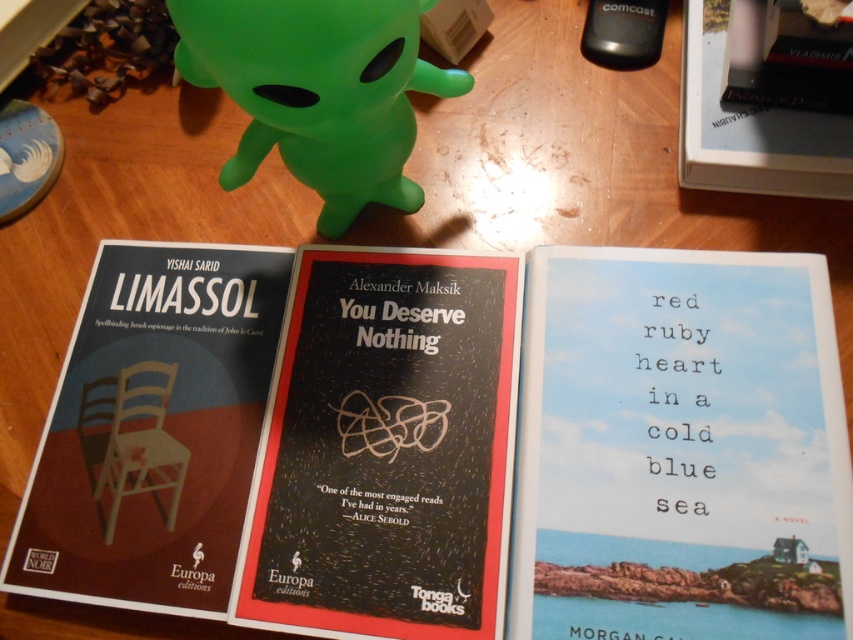
Question: Is matte black chair at center left positioned behind green rubber toy at upper center?

Choices:
 (A) yes
 (B) no

Answer: (A)

Question: Which point appears closest to the camera in this image?

Choices:
 (A) (254, 561)
 (B) (161, 282)
 (C) (689, 12)
 (D) (837, 605)

Answer: (D)

Question: Is blue paper cover at center to the left of matte black chair at center left from the viewer's perspective?

Choices:
 (A) yes
 (B) no

Answer: (B)

Question: In this image, where is green rubber toy at upper center located relative to hardcover book at upper right?

Choices:
 (A) right
 (B) left

Answer: (B)

Question: Which object is positioned closest to the matte black chair at center left?

Choices:
 (A) black matte book cover at center
 (B) green rubber toy at upper center
 (C) hardcover book at upper right

Answer: (A)

Question: Among these points, which one is farthest from the camera?

Choices:
 (A) (786, 538)
 (B) (331, 196)
 (C) (212, 570)

Answer: (B)